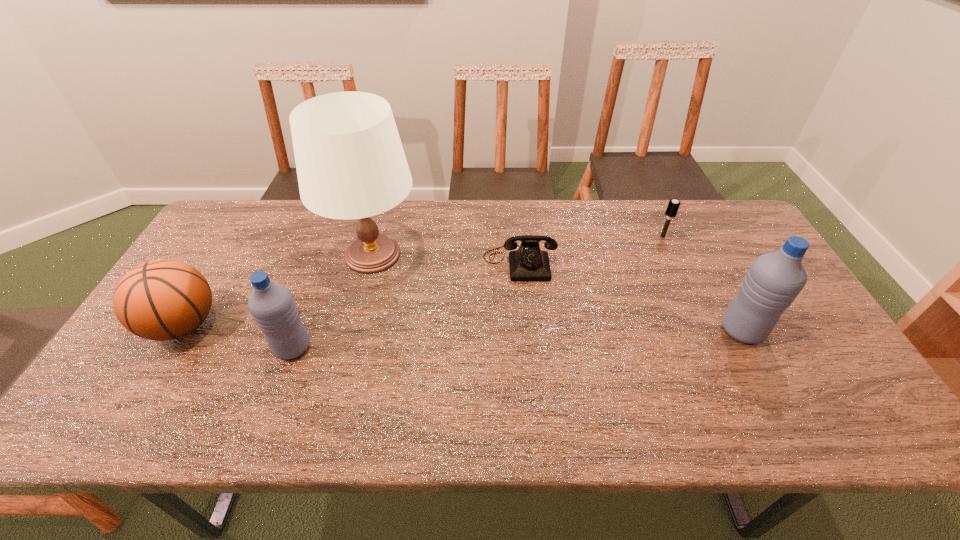
Where is `the shorter water bottle`? This screenshot has width=960, height=540. the shorter water bottle is located at coordinates (272, 306).

Locate an element on the screen. Image resolution: width=960 pixels, height=540 pixels. the left water bottle is located at coordinates (272, 306).

Find the location of a particular element. This screenshot has width=960, height=540. the taller water bottle is located at coordinates (774, 280).

This screenshot has width=960, height=540. Identify the location of the rightmost object. (774, 280).

Identify the location of hairbrush. (673, 206).

You are a GUI agent. You are given a task and a screenshot of the screen. Output one action in this format:
    pyautogui.click(x=<x>, y=<y>)
    Task: Click on the fifth tallest object
    
    Given the screenshot: What is the action you would take?
    (673, 206)

The image size is (960, 540). In order to click on the third object from right to left in this screenshot , I will do `click(529, 263)`.

Find the location of a particular element. This screenshot has width=960, height=540. telephone is located at coordinates (529, 263).

At what (x,y) coordinates should I click in order to perform the action: click on the tallest object. Please return your answer as a coordinate pair (x, y). Image resolution: width=960 pixels, height=540 pixels. Looking at the image, I should click on (350, 162).

The image size is (960, 540). What are the coordinates of `the leftmost object` in the screenshot? It's located at (160, 300).